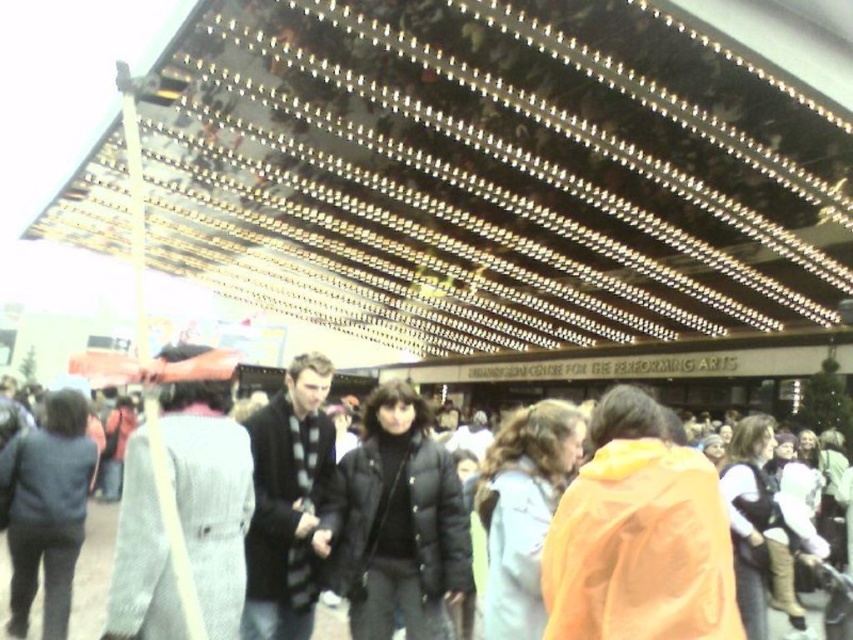
Is gray wool coat at center taller than black puffer jacket at center?

No.

Who is positioned more to the right, gray wool coat at center or black puffer jacket at center?

black puffer jacket at center is more to the right.

Image resolution: width=853 pixels, height=640 pixels. What do you see at coordinates (210, 493) in the screenshot? I see `gray wool coat at center` at bounding box center [210, 493].

This screenshot has width=853, height=640. Identify the location of gray wool coat at center. point(210,493).

Is orange matte jacket at lower right positioned before gray wool coat at center?

Yes, it is in front of gray wool coat at center.

Who is taller, orange matte jacket at lower right or gray wool coat at center?

gray wool coat at center

Is point (666, 474) positioned in front of point (161, 400)?

Yes, it is.

Locate an element on the screen. orange matte jacket at lower right is located at coordinates (640, 548).

Between orange matte jacket at lower right and black puffer jacket at center, which one has more height?

With more height is black puffer jacket at center.

Consider the image. Is orange matte jacket at lower right closer to camera compared to black puffer jacket at center?

Yes, it is in front of black puffer jacket at center.

Between point (579, 620) and point (688, 380), which one is positioned in front?

Point (579, 620) is in front.

Locate an element on the screen. orange matte jacket at lower right is located at coordinates (640, 548).